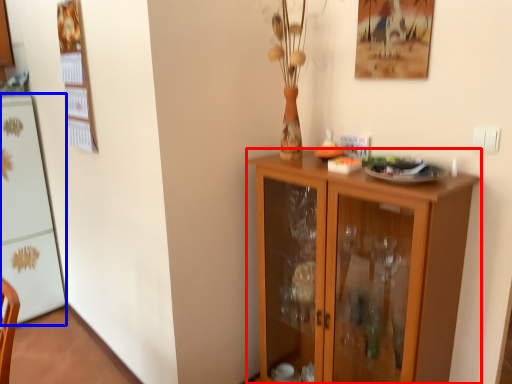
Question: Which object is further to the camera taking this photo, cupboard (highlighted by a red box) or appliance (highlighted by a blue box)?

Choices:
 (A) cupboard
 (B) appliance

Answer: (B)